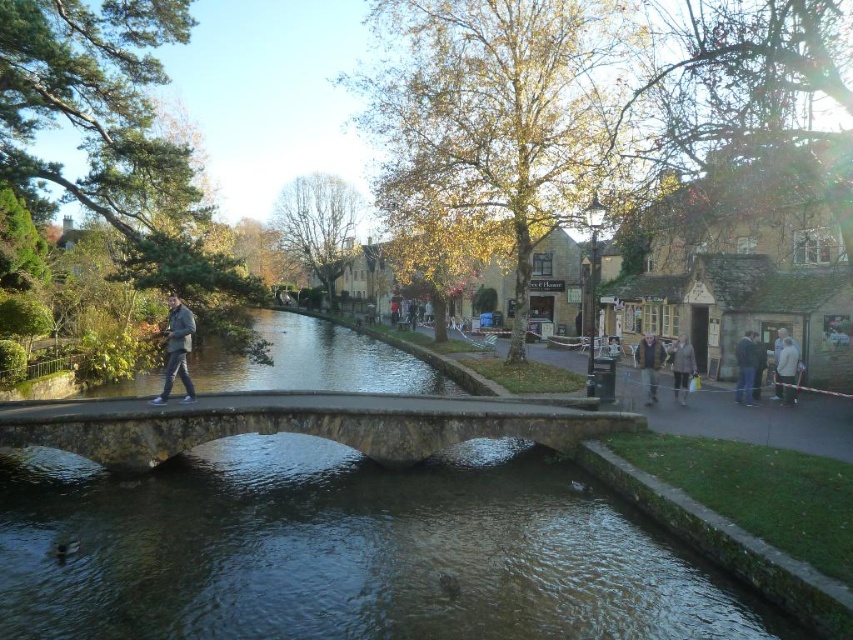
Between blue denim jeans at right and white woolen sweater at center-right, which one appears on the right side from the viewer's perspective?

From the viewer's perspective, white woolen sweater at center-right appears more on the right side.

Is blue denim jeans at right further to camera compared to white woolen sweater at center-right?

That is True.

Is point (738, 364) positioned in front of point (791, 401)?

No, it is behind (791, 401).

The width and height of the screenshot is (853, 640). In order to click on blue denim jeans at right in this screenshot , I will do `click(746, 368)`.

Between point (173, 321) and point (653, 342), which one is positioned behind?

The point (653, 342) is behind.

Is point (178, 317) positioned after point (663, 349)?

No, (178, 317) is closer to viewer.

Find the location of a particular element. dark gray jacket at center is located at coordinates (177, 349).

Who is positioned more to the left, stone bridge at center or dark green jacket at right?

stone bridge at center is more to the left.

Can you confirm if stone bridge at center is positioned above dark green jacket at right?

Incorrect, stone bridge at center is not positioned above dark green jacket at right.

Which is behind, point (335, 410) or point (759, 369)?

The point (759, 369) is more distant.

Where is `stone bridge at center`? The height and width of the screenshot is (640, 853). stone bridge at center is located at coordinates (302, 422).